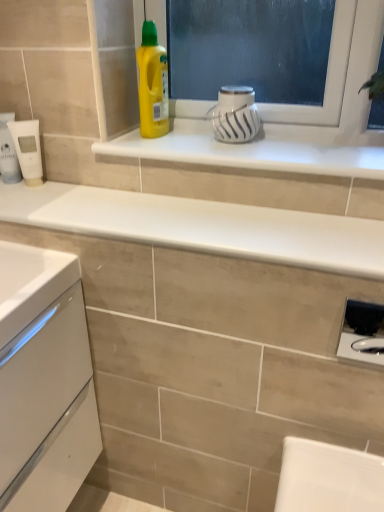
Locate an element on the screen. free spot above white glossy countertop at upper center (from a real-world perspective) is located at coordinates (158, 209).